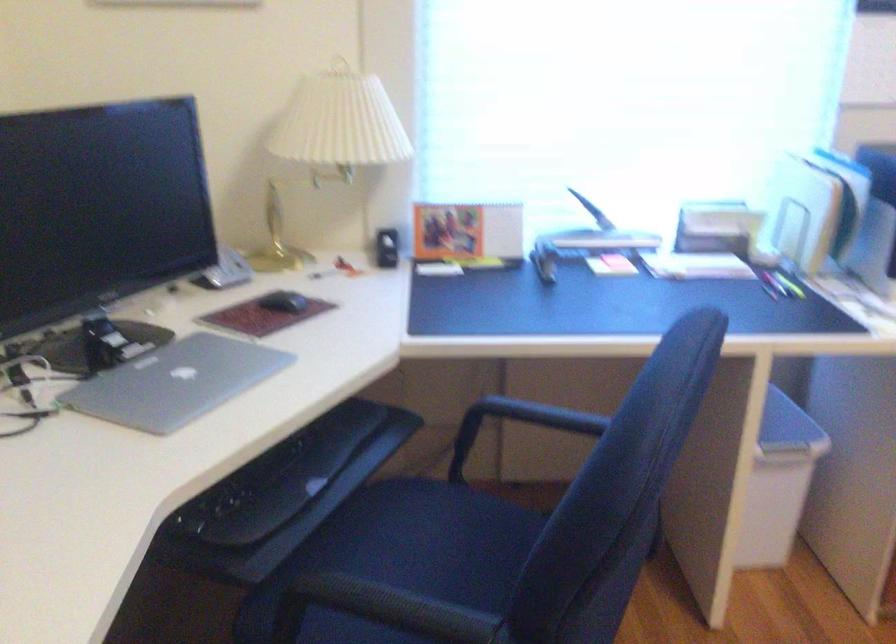
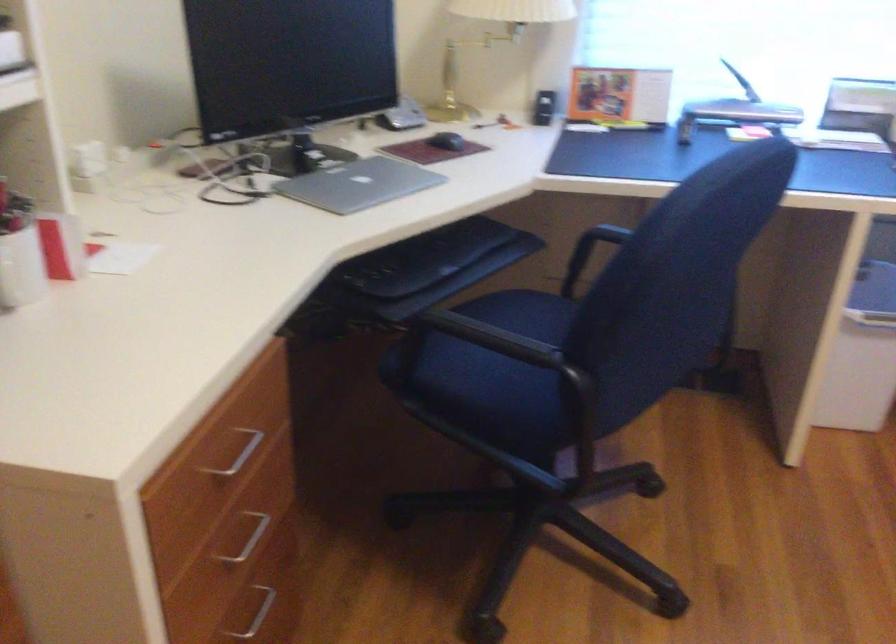
Locate, in the second image, the point that corresponds to (x=179, y=386) in the first image.

(358, 184)